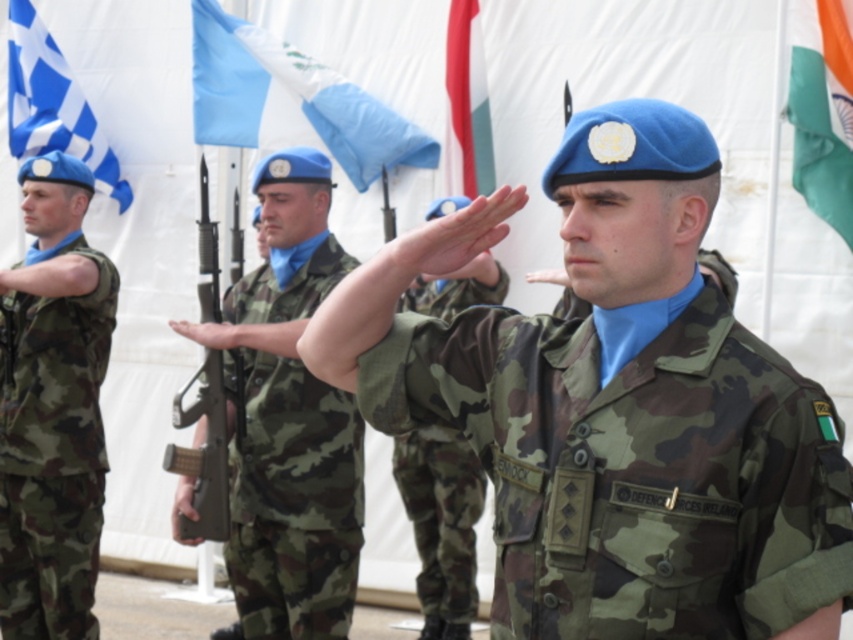
Is point (180, 326) more distant than point (363, 150)?

No, it is not.

Who is more distant from viewer, (337, 566) or (286, 134)?

Point (286, 134)

Is point (276, 561) positioned after point (263, 138)?

No, (276, 561) is in front of (263, 138).

Locate an element on the screen. The height and width of the screenshot is (640, 853). camo uniform at center is located at coordinates pos(289,419).

Does green fabric flag at upper right have a larger size compared to red fabric flag at upper center?

Yes.

Between point (792, 173) and point (482, 70), which one is positioned in front?

Point (792, 173)

Does point (838, 1) lie behind point (445, 72)?

No, (838, 1) is closer to viewer.

Locate an element on the screen. Image resolution: width=853 pixels, height=640 pixels. green fabric flag at upper right is located at coordinates (822, 108).

Who is taller, blue fabric flag at upper center or blue checkered flag at upper left?

Standing taller between the two is blue checkered flag at upper left.

Is point (318, 132) positioned after point (35, 147)?

No, (318, 132) is in front of (35, 147).

This screenshot has height=640, width=853. In order to click on blue fabric flag at upper center in this screenshot , I will do `click(291, 100)`.